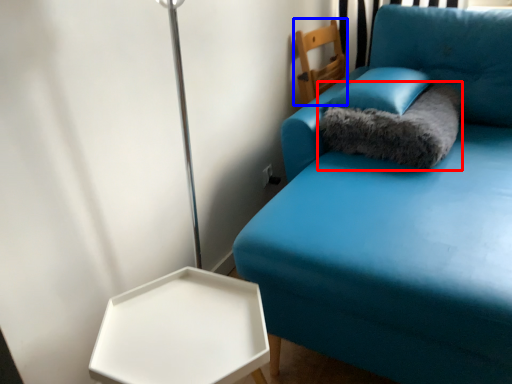
Question: Which object appears farthest to the camera in this image, cat bed (highlighted by a red box) or furniture (highlighted by a blue box)?

Choices:
 (A) cat bed
 (B) furniture

Answer: (B)